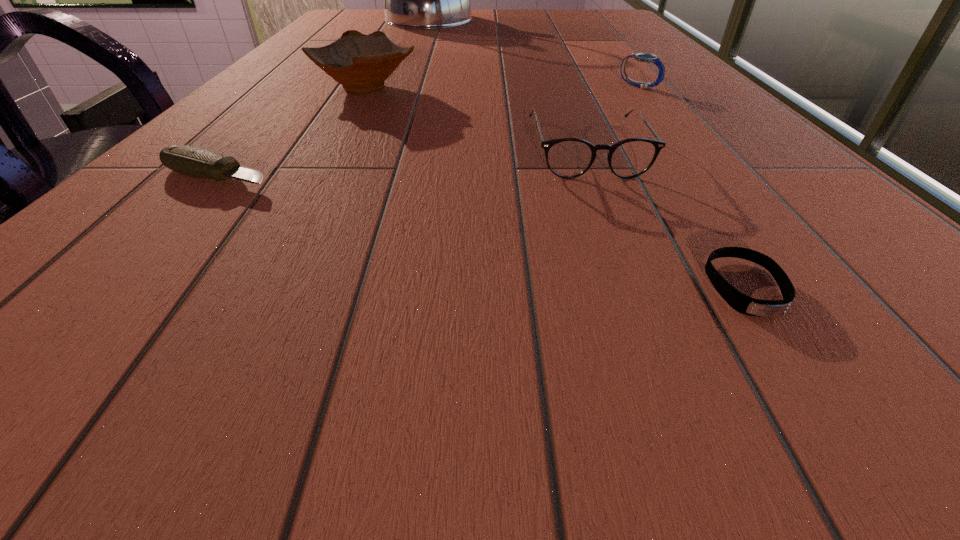
Locate an element on the screen. This screenshot has height=540, width=960. object situated at the far left corner is located at coordinates (413, 0).

I want to click on vacant point at the far edge, so click(524, 16).

This screenshot has height=540, width=960. In order to click on free space at the near edge of the desktop in this screenshot , I will do `click(794, 423)`.

In the image, there is a desktop. Identify the location of vacant area at the left edge. (311, 42).

The width and height of the screenshot is (960, 540). In order to click on free space at the right edge of the desktop in this screenshot , I will do `click(619, 35)`.

At what (x,y) coordinates should I click in order to perform the action: click on free space at the far right corner. Please return your answer as a coordinate pair (x, y). This screenshot has height=540, width=960. Looking at the image, I should click on (612, 18).

Where is `unoccupied position between the nearest object and the second tallest object`? unoccupied position between the nearest object and the second tallest object is located at coordinates (555, 187).

The height and width of the screenshot is (540, 960). What are the coordinates of `vacant space in between the shortest object and the spectacles` in the screenshot? It's located at (665, 219).

You are a GUI agent. You are given a task and a screenshot of the screen. Output one action in this format:
    pyautogui.click(x=<x>, y=<y>)
    Task: Click on the vacant area that lies between the shortest object and the pocketknife
    
    Given the screenshot: What is the action you would take?
    pyautogui.click(x=482, y=232)

Find the location of a particular element. vacant area that lies between the kettle and the spectacles is located at coordinates (510, 85).